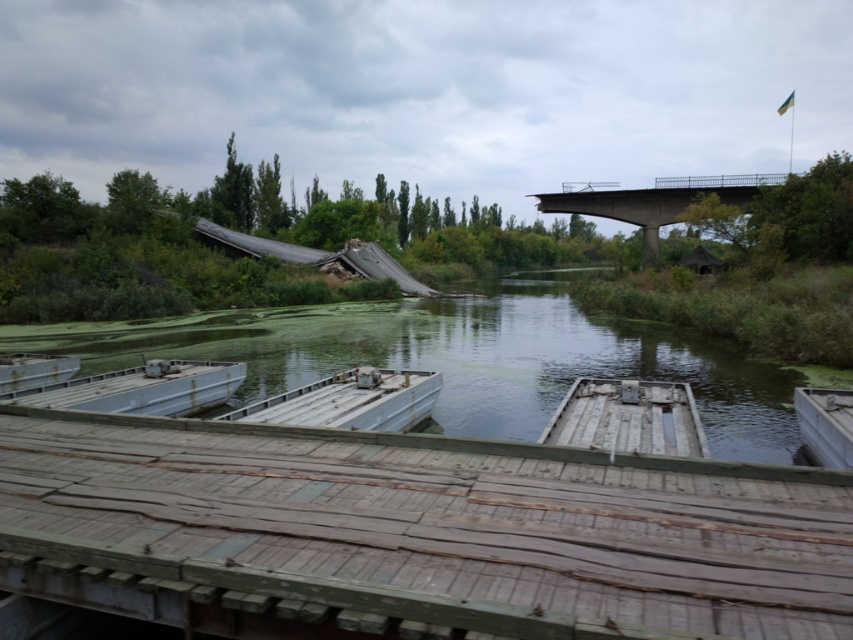
You are standing on the wooden walkway in the foreground of the river scene. You see the rusty metal boat at center. Can you determine if the boat is positioned closer to the collapsed bridge structure or the edge of the walkway?

The rusty metal boat at center is located at point coordinates that place it closer to the collapsed bridge structure compared to the edge of the walkway. Therefore, the boat is nearer to the bridge.